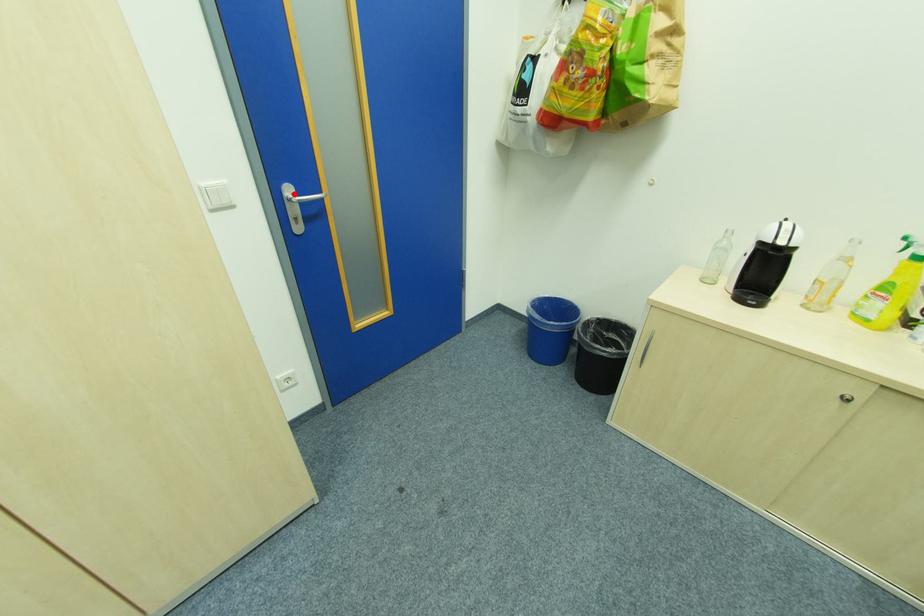
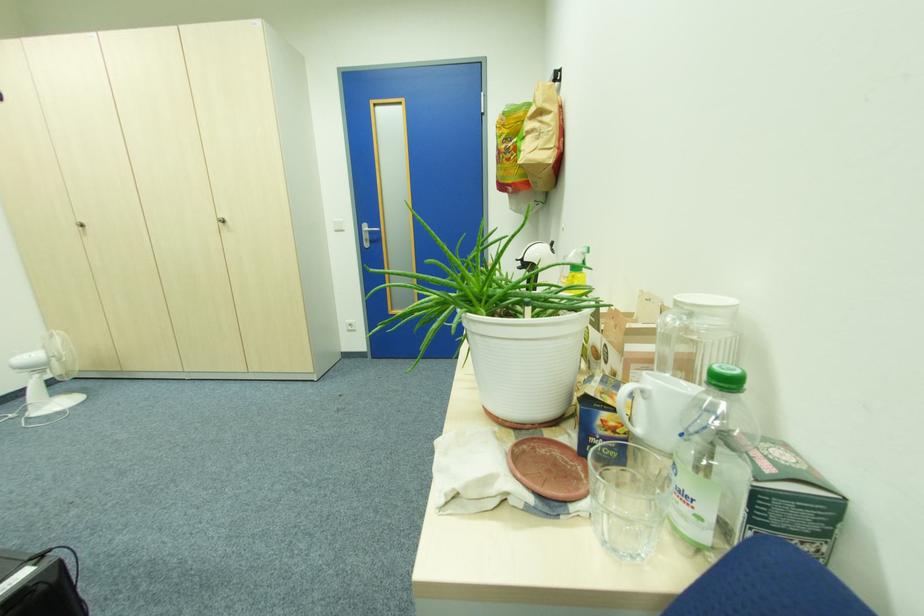
The point at the highlighted location is marked in the first image. Where is the corresponding point in the second image?

(371, 229)